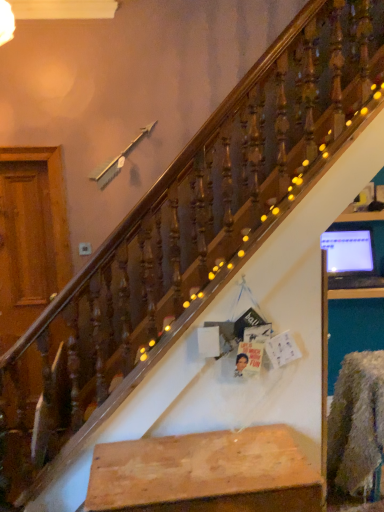
Locate an element on the screen. matte black monitor at upper right is located at coordinates (348, 251).

The height and width of the screenshot is (512, 384). What do you see at coordinates (348, 251) in the screenshot?
I see `matte black monitor at upper right` at bounding box center [348, 251].

This screenshot has width=384, height=512. What do you see at coordinates (205, 474) in the screenshot?
I see `wooden plank at center` at bounding box center [205, 474].

Locate an element on the screen. wooden plank at center is located at coordinates (205, 474).

This screenshot has width=384, height=512. Find the location of `matte black monitor at upper right`. matte black monitor at upper right is located at coordinates (348, 251).

Can you confirm if matte black monitor at upper right is positioned to the left of wooden plank at center?

In fact, matte black monitor at upper right is to the right of wooden plank at center.

Considering the relative positions of matte black monitor at upper right and wooden plank at center in the image provided, is matte black monitor at upper right in front of wooden plank at center?

No, it is not.

Between point (339, 232) and point (91, 487), which one is positioned behind?

Positioned behind is point (339, 232).

From the image's perspective, is matte black monitor at upper right below wooden plank at center?

No, from the image's perspective, matte black monitor at upper right is not below wooden plank at center.

From a real-world perspective, is matte black monitor at upper right positioned above or below wooden plank at center?

Clearly, from a real-world perspective, matte black monitor at upper right is above wooden plank at center.

Looking at their sizes, would you say matte black monitor at upper right is wider or thinner than wooden plank at center?

matte black monitor at upper right is thinner than wooden plank at center.

Which of these two, matte black monitor at upper right or wooden plank at center, stands taller?

With more height is wooden plank at center.

Which of these two, matte black monitor at upper right or wooden plank at center, is smaller?

matte black monitor at upper right.

Do you think matte black monitor at upper right is within wooden plank at center, or outside of it?

matte black monitor at upper right is not inside wooden plank at center, it's outside.

Can you see matte black monitor at upper right touching wooden plank at center?

No, matte black monitor at upper right is not next to wooden plank at center.

Is matte black monitor at upper right facing towards wooden plank at center?

No, matte black monitor at upper right is not facing towards wooden plank at center.

How far apart are matte black monitor at upper right and wooden plank at center?

matte black monitor at upper right is 5.49 feet away from wooden plank at center.

Where is `computer monitor behind the wooden plank at center`? This screenshot has height=512, width=384. computer monitor behind the wooden plank at center is located at coordinates (348, 251).

From the picture: Which object is positioned more to the left, wooden plank at center or matte black monitor at upper right?

Positioned to the left is wooden plank at center.

Is the position of wooden plank at center more distant than that of matte black monitor at upper right?

No, the depth of wooden plank at center is less than that of matte black monitor at upper right.

Is point (240, 457) positioned in front of point (322, 248)?

Yes, point (240, 457) is in front of point (322, 248).

From the image's perspective, which is above, wooden plank at center or matte black monitor at upper right?

matte black monitor at upper right, from the image's perspective.

From a real-world perspective, is wooden plank at center physically below matte black monitor at upper right?

Correct, in the physical world, wooden plank at center is lower than matte black monitor at upper right.

Does wooden plank at center have a lesser width compared to matte black monitor at upper right?

Incorrect, the width of wooden plank at center is not less than that of matte black monitor at upper right.

From their relative heights in the image, would you say wooden plank at center is taller or shorter than matte black monitor at upper right?

wooden plank at center is taller than matte black monitor at upper right.

Considering the sizes of objects wooden plank at center and matte black monitor at upper right in the image provided, who is bigger, wooden plank at center or matte black monitor at upper right?

Bigger between the two is wooden plank at center.

Would you say matte black monitor at upper right is part of wooden plank at center's contents?

No, matte black monitor at upper right is not inside wooden plank at center.

Is wooden plank at center not near matte black monitor at upper right?

Yes, wooden plank at center and matte black monitor at upper right are located far from each other.

Is wooden plank at center turned away from matte black monitor at upper right?

No, wooden plank at center is not facing the opposite direction of matte black monitor at upper right.

How many degrees apart are the facing directions of wooden plank at center and matte black monitor at upper right?

They differ by 5.22 degrees in their facing directions.

Measure the distance from wooden plank at center to matte black monitor at upper right.

wooden plank at center is 5.49 feet from matte black monitor at upper right.

This screenshot has width=384, height=512. I want to click on furniture on the left of matte black monitor at upper right, so click(205, 474).

Where is `computer monitor that is behind the wooden plank at center`? computer monitor that is behind the wooden plank at center is located at coordinates (348, 251).

This screenshot has height=512, width=384. What are the coordinates of `furniture on the left of matte black monitor at upper right` in the screenshot? It's located at (205, 474).